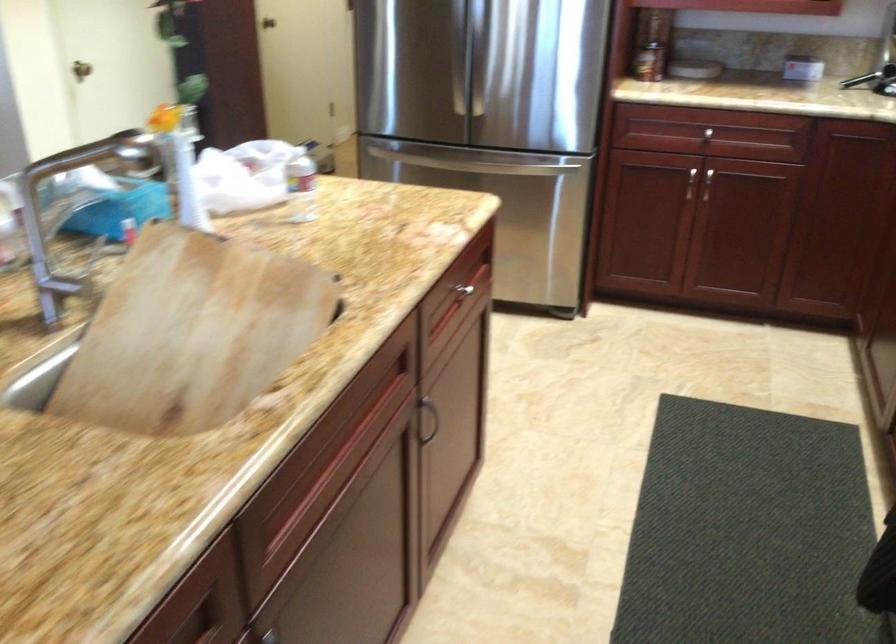
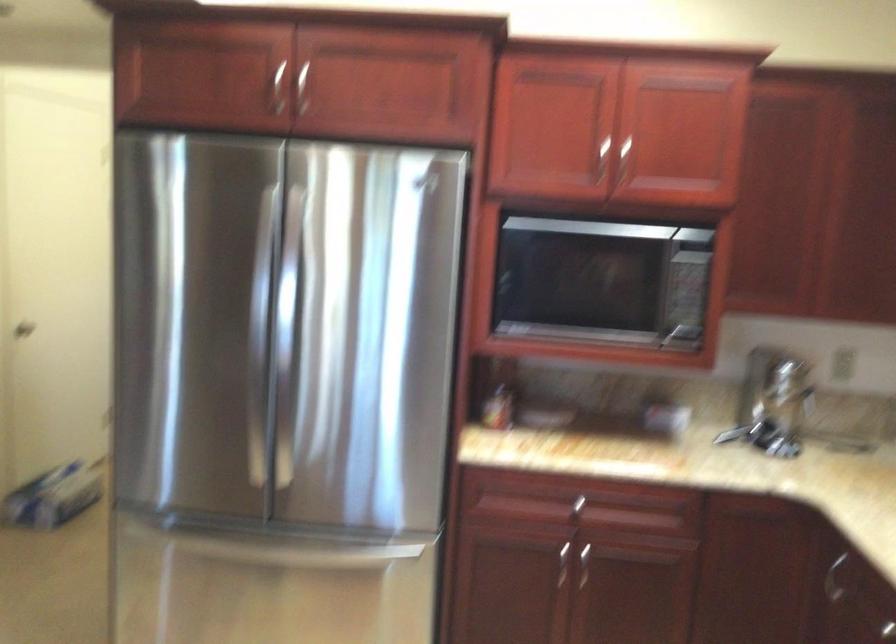
Question: Which direction would the cameraman need to move to produce the second image? Reply with the corresponding letter.

Choices:
 (A) Left
 (B) Right
 (C) Forward
 (D) Backward

Answer: (C)